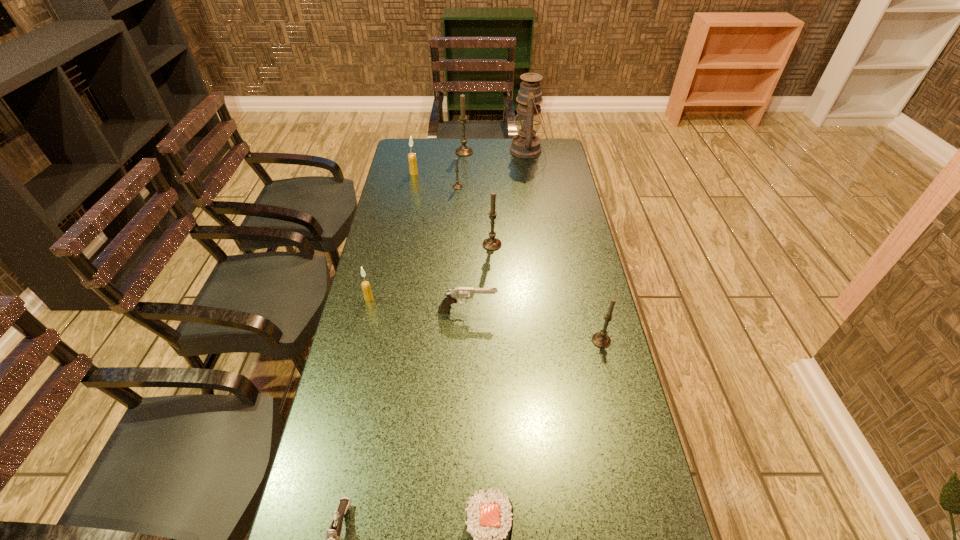
This screenshot has height=540, width=960. I want to click on the second object from right to left, so click(525, 144).

Where is `blue oil lamp`? blue oil lamp is located at coordinates (525, 144).

This screenshot has width=960, height=540. What are the coordinates of `the second tallest object` in the screenshot? It's located at (463, 150).

The image size is (960, 540). I want to click on the farthest gray candle, so click(463, 150).

Find the location of `the third tallest object`. the third tallest object is located at coordinates (492, 243).

You are a GUI agent. You are given a task and a screenshot of the screen. Output one action in this format:
    pyautogui.click(x=<x>, y=<y>)
    Task: Click on the third farthest gray candle
    
    Given the screenshot: What is the action you would take?
    pyautogui.click(x=492, y=243)

Identify the location of the eighth nearest object. (413, 169).

Find the location of a particular element. the right cream candle is located at coordinates (413, 169).

Locate an element on the screen. Image resolution: width=960 pixels, height=540 pixels. the third biggest gray candle is located at coordinates (600, 339).

At what (x,y) coordinates should I click in order to perform the action: click on the rightmost candle. Please return your answer as a coordinate pair (x, y). The width and height of the screenshot is (960, 540). Looking at the image, I should click on (600, 339).